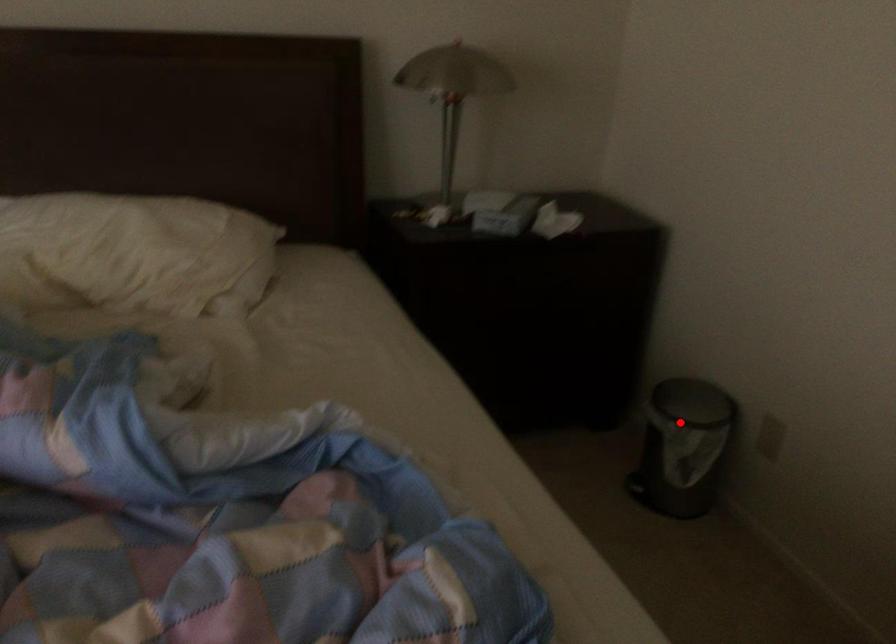
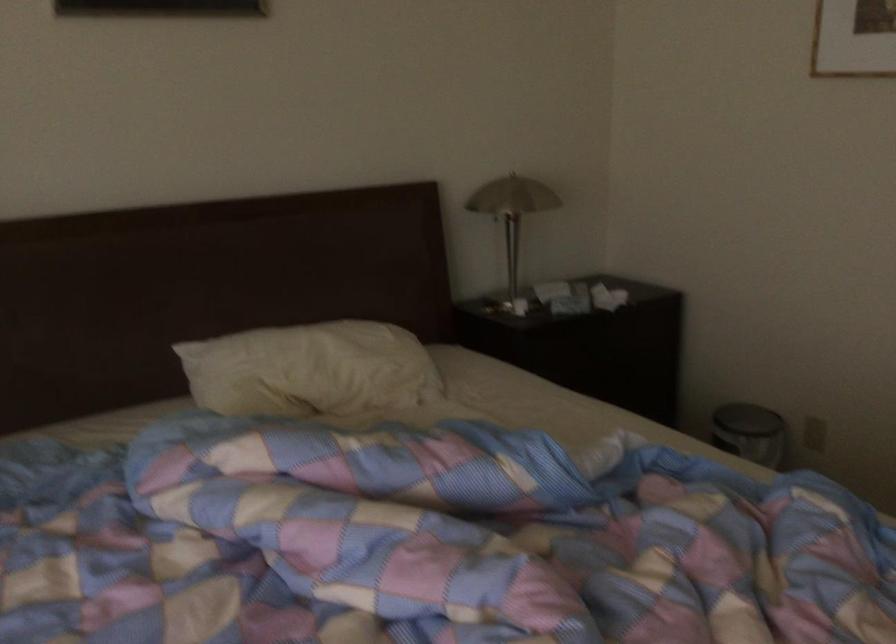
Question: I am providing you with two images of the same scene from different viewpoints. Given a red point in image1, look at the same physical point in image2. Is it:

Choices:
 (A) Closer to the viewpoint
 (B) Farther from the viewpoint

Answer: (B)